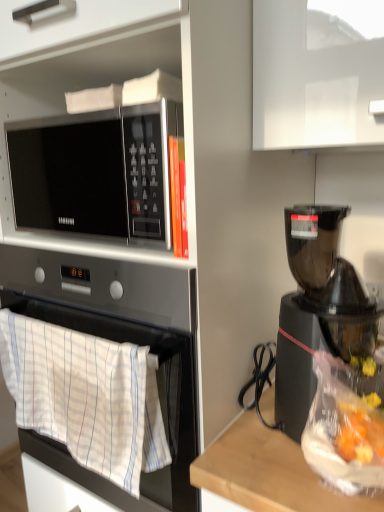
Question: Considering the relative positions of white cotton towel at lower left and sleek silver microwave at upper left in the image provided, is white cotton towel at lower left behind sleek silver microwave at upper left?

Choices:
 (A) no
 (B) yes

Answer: (A)

Question: Is white cotton towel at lower left to the right of sleek silver microwave at upper left from the viewer's perspective?

Choices:
 (A) no
 (B) yes

Answer: (A)

Question: Are white cotton towel at lower left and sleek silver microwave at upper left beside each other?

Choices:
 (A) yes
 (B) no

Answer: (B)

Question: From a real-world perspective, is white cotton towel at lower left positioned over sleek silver microwave at upper left based on gravity?

Choices:
 (A) yes
 (B) no

Answer: (B)

Question: Is white cotton towel at lower left oriented away from sleek silver microwave at upper left?

Choices:
 (A) no
 (B) yes

Answer: (A)

Question: Can you confirm if white cotton towel at lower left is shorter than sleek silver microwave at upper left?

Choices:
 (A) no
 (B) yes

Answer: (A)

Question: Is sleek silver microwave at upper left placed right next to black plastic coffee maker at right?

Choices:
 (A) no
 (B) yes

Answer: (A)

Question: Is sleek silver microwave at upper left wider than black plastic coffee maker at right?

Choices:
 (A) yes
 (B) no

Answer: (B)

Question: From a real-world perspective, is sleek silver microwave at upper left positioned over black plastic coffee maker at right based on gravity?

Choices:
 (A) no
 (B) yes

Answer: (B)

Question: Does sleek silver microwave at upper left have a greater height compared to black plastic coffee maker at right?

Choices:
 (A) yes
 (B) no

Answer: (B)

Question: Could you tell me if sleek silver microwave at upper left is facing black plastic coffee maker at right?

Choices:
 (A) no
 (B) yes

Answer: (A)

Question: Is sleek silver microwave at upper left facing away from black plastic coffee maker at right?

Choices:
 (A) yes
 (B) no

Answer: (B)

Question: From a real-world perspective, is black plastic coffee maker at right located higher than white cotton towel at lower left?

Choices:
 (A) no
 (B) yes

Answer: (B)